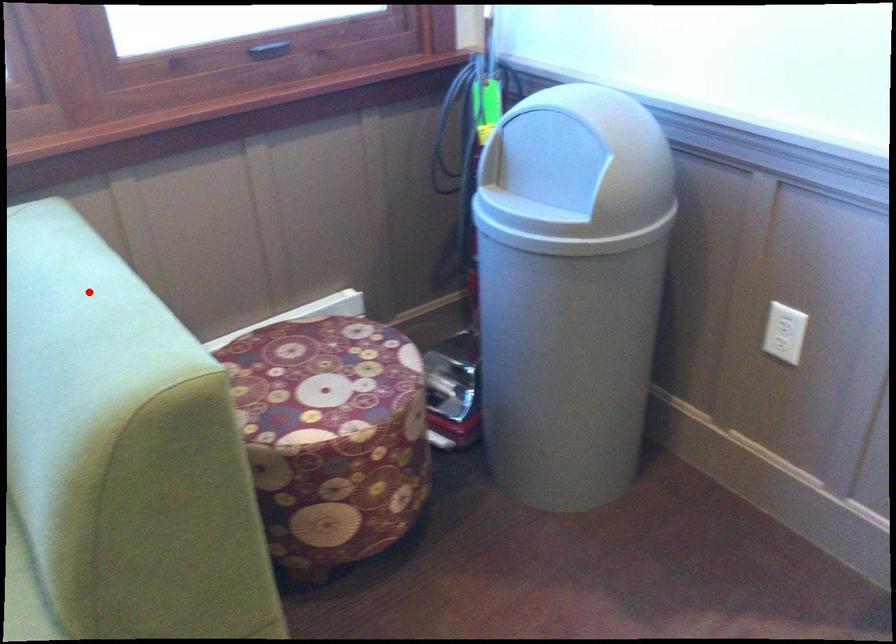
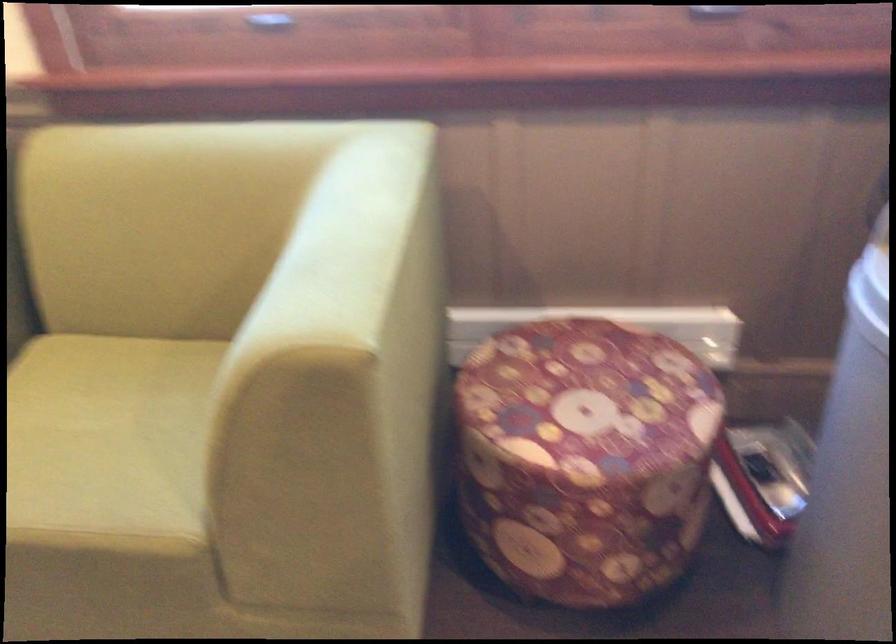
Where in the second image is the point corresponding to the highlighted location from the first image?

(358, 223)